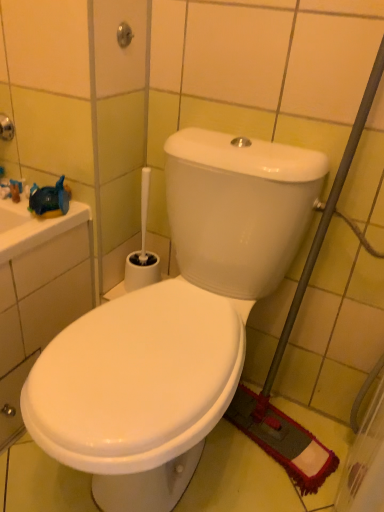
Question: Considering the relative positions of white plastic toilet brush at lower center and white glossy toilet at center in the image provided, is white plastic toilet brush at lower center to the left of white glossy toilet at center from the viewer's perspective?

Choices:
 (A) yes
 (B) no

Answer: (A)

Question: Would you say white plastic toilet brush at lower center contains white glossy toilet at center?

Choices:
 (A) yes
 (B) no

Answer: (B)

Question: Is white plastic toilet brush at lower center touching white glossy toilet at center?

Choices:
 (A) no
 (B) yes

Answer: (A)

Question: Would you say white plastic toilet brush at lower center is a long distance from white glossy toilet at center?

Choices:
 (A) no
 (B) yes

Answer: (A)

Question: Does white plastic toilet brush at lower center have a smaller size compared to white glossy toilet at center?

Choices:
 (A) yes
 (B) no

Answer: (A)

Question: Is white plastic toilet brush at lower center oriented towards white glossy toilet at center?

Choices:
 (A) no
 (B) yes

Answer: (A)

Question: From a real-world perspective, is white glossy toilet at center on top of white plastic toilet brush at lower center?

Choices:
 (A) no
 (B) yes

Answer: (A)

Question: Does white glossy toilet at center have a greater width compared to white plastic toilet brush at lower center?

Choices:
 (A) no
 (B) yes

Answer: (B)

Question: Is white glossy toilet at center positioned behind white plastic toilet brush at lower center?

Choices:
 (A) no
 (B) yes

Answer: (A)

Question: Does white glossy toilet at center have a lesser height compared to white plastic toilet brush at lower center?

Choices:
 (A) yes
 (B) no

Answer: (B)

Question: Could you tell me if white glossy toilet at center is turned towards white plastic toilet brush at lower center?

Choices:
 (A) yes
 (B) no

Answer: (B)

Question: Is white glossy toilet at center in front of white plastic toilet brush at lower center?

Choices:
 (A) yes
 (B) no

Answer: (A)

Question: Is brushed metal showerhead at upper center at the back of white glossy toilet at center?

Choices:
 (A) no
 (B) yes

Answer: (A)